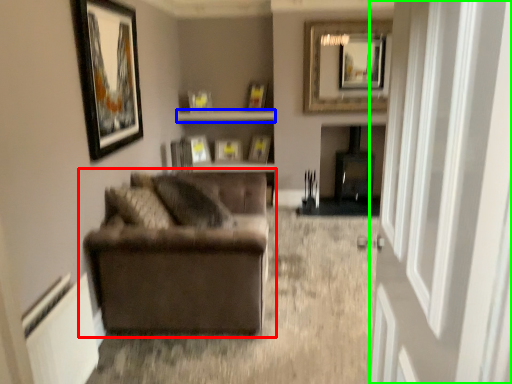
Question: Considering the real-world distances, which object is closest to studio couch (highlighted by a red box)? shelf (highlighted by a blue box) or glass door (highlighted by a green box).

Choices:
 (A) shelf
 (B) glass door

Answer: (B)